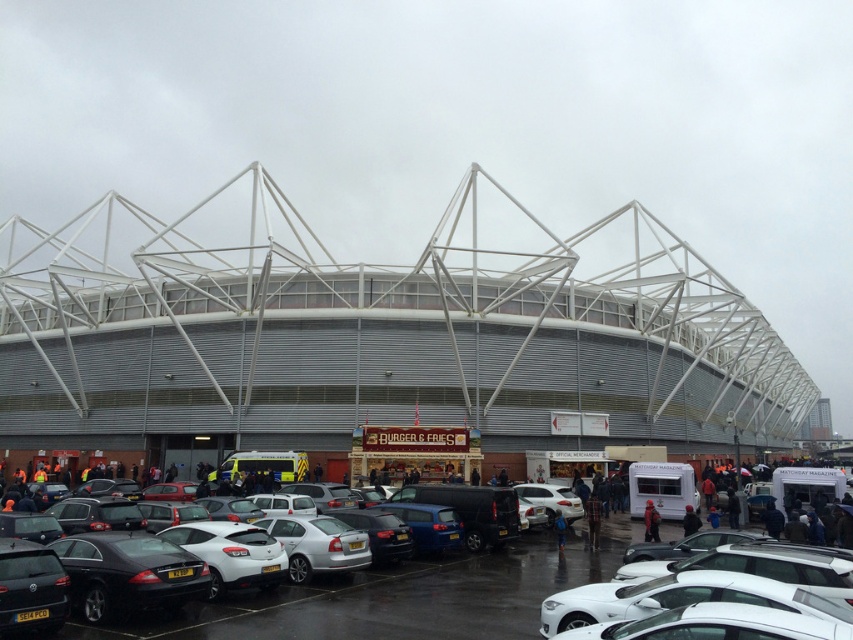
Is metallic cars at center above white matte car at center?

Yes.

Between metallic cars at center and white matte car at center, which one appears on the right side from the viewer's perspective?

white matte car at center

Locate an element on the screen. The width and height of the screenshot is (853, 640). metallic cars at center is located at coordinates (397, 596).

Looking at this image, can you confirm if black glossy sedan at lower left is thinner than silver metallic sedan at center?

Yes.

Does black glossy sedan at lower left have a larger size compared to silver metallic sedan at center?

No, black glossy sedan at lower left is not bigger than silver metallic sedan at center.

Which is in front, point (170, 605) or point (368, 545)?

Positioned in front is point (170, 605).

Image resolution: width=853 pixels, height=640 pixels. In order to click on black glossy sedan at lower left in this screenshot , I will do `click(128, 573)`.

Who is higher up, black glossy sedan at lower left or white matte car at center?

black glossy sedan at lower left is above.

Is point (132, 595) positioned behind point (544, 502)?

No, (132, 595) is in front of (544, 502).

Which is in front, point (102, 538) or point (547, 522)?

Point (102, 538)

Where is `black glossy sedan at lower left`? black glossy sedan at lower left is located at coordinates (128, 573).